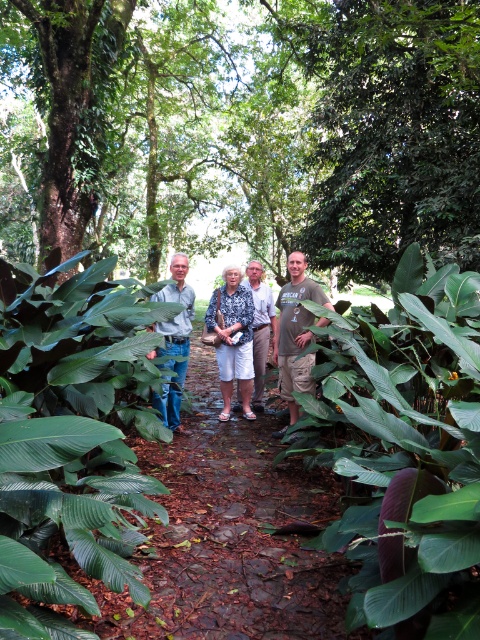
Question: Which point appears closest to the camera in this image?

Choices:
 (A) (165, 400)
 (B) (392, 522)

Answer: (B)

Question: Is green leafy plant at center positioned at the back of white cotton shorts at center?

Choices:
 (A) no
 (B) yes

Answer: (A)

Question: Is green leafy plant at center behind white cotton shorts at center?

Choices:
 (A) yes
 (B) no

Answer: (B)

Question: Is green leafy plant at center to the left of white cotton shorts at center from the viewer's perspective?

Choices:
 (A) yes
 (B) no

Answer: (A)

Question: Among these objects, which one is nearest to the camera?

Choices:
 (A) green leafy plant at center
 (B) purple leafy plant at center

Answer: (B)

Question: Among these objects, which one is farthest from the camera?

Choices:
 (A) green leafy plant at center
 (B) white cotton shorts at center

Answer: (B)